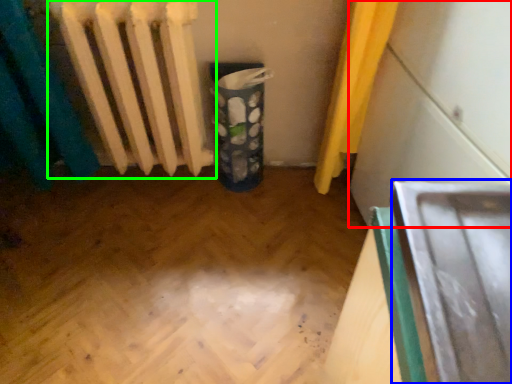
Question: Considering the real-world distances, which object is closest to wide (highlighted by a red box)? wide (highlighted by a blue box) or radiator (highlighted by a green box).

Choices:
 (A) wide
 (B) radiator

Answer: (A)